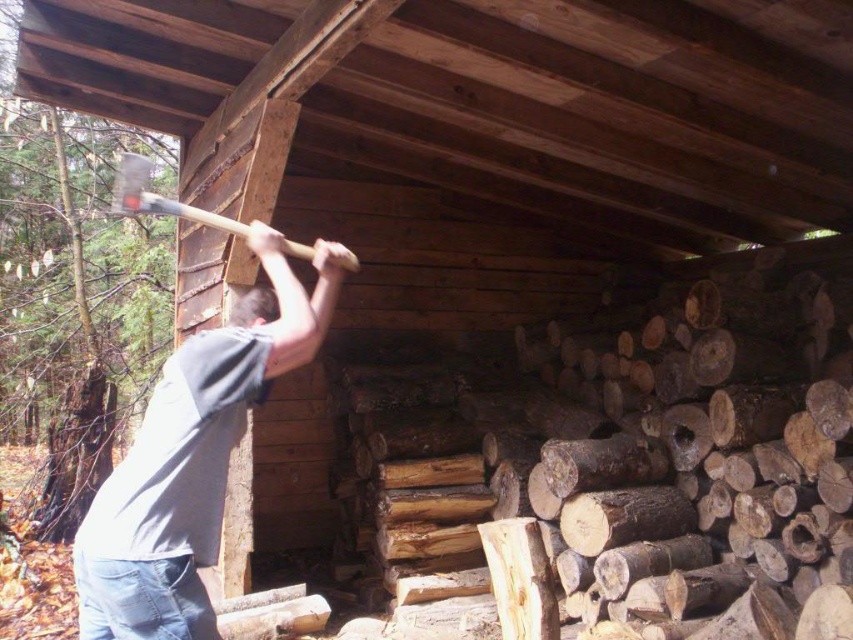
Can you confirm if matte wooden hammer at upper center is bigger than dark brown hair at upper center?

→ Yes.

Does point (181, 202) come farther from viewer compared to point (262, 289)?

Yes, it is.

Between point (117, 202) and point (244, 298), which one is positioned behind?

Point (117, 202)

Find the location of a particular element. This screenshot has height=640, width=853. matte wooden hammer at upper center is located at coordinates (160, 196).

Which is above, gray cotton shirt at upper left or dark brown hair at upper center?

dark brown hair at upper center is higher up.

Does gray cotton shirt at upper left have a greater width compared to dark brown hair at upper center?

Yes, gray cotton shirt at upper left is wider than dark brown hair at upper center.

Find the location of a particular element. gray cotton shirt at upper left is located at coordinates (190, 461).

How distant is gray cotton shirt at upper left from matte wooden hammer at upper center?

gray cotton shirt at upper left is 5.20 meters from matte wooden hammer at upper center.

Describe the element at coordinates (190, 461) in the screenshot. I see `gray cotton shirt at upper left` at that location.

Locate an element on the screen. The height and width of the screenshot is (640, 853). gray cotton shirt at upper left is located at coordinates (190, 461).